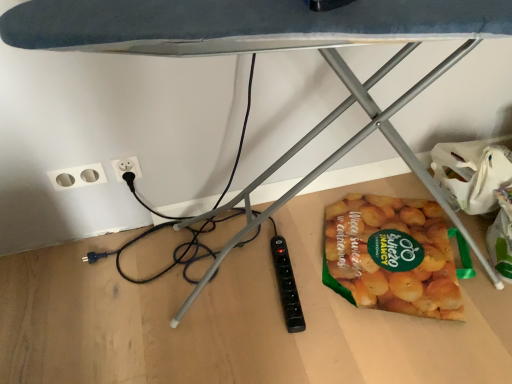
Question: From the image's perspective, is translucent plastic bag of sliced potatoes at lower right located beneath white plastic electric outlet at lower left?

Choices:
 (A) no
 (B) yes

Answer: (B)

Question: From a real-world perspective, is translucent plastic bag of sliced potatoes at lower right physically above white plastic electric outlet at lower left?

Choices:
 (A) yes
 (B) no

Answer: (B)

Question: Is translucent plastic bag of sliced potatoes at lower right further to camera compared to white plastic electric outlet at lower left?

Choices:
 (A) yes
 (B) no

Answer: (B)

Question: Is white plastic electric outlet at lower left inside translucent plastic bag of sliced potatoes at lower right?

Choices:
 (A) no
 (B) yes

Answer: (A)

Question: Does translucent plastic bag of sliced potatoes at lower right have a greater width compared to white plastic electric outlet at lower left?

Choices:
 (A) yes
 (B) no

Answer: (A)

Question: Does translucent plastic bag of sliced potatoes at lower right have a lesser width compared to white plastic electric outlet at lower left?

Choices:
 (A) no
 (B) yes

Answer: (A)

Question: From a real-world perspective, is white plastic socket at lower left positioned over translucent plastic bag of sliced potatoes at lower right based on gravity?

Choices:
 (A) yes
 (B) no

Answer: (A)

Question: Does white plastic socket at lower left appear on the left side of translucent plastic bag of sliced potatoes at lower right?

Choices:
 (A) no
 (B) yes

Answer: (B)

Question: From the image's perspective, does white plastic socket at lower left appear higher than translucent plastic bag of sliced potatoes at lower right?

Choices:
 (A) no
 (B) yes

Answer: (B)

Question: Would you say white plastic socket at lower left is outside translucent plastic bag of sliced potatoes at lower right?

Choices:
 (A) no
 (B) yes

Answer: (B)

Question: Would you say translucent plastic bag of sliced potatoes at lower right is part of white plastic socket at lower left's contents?

Choices:
 (A) yes
 (B) no

Answer: (B)

Question: From the image's perspective, is white plastic socket at lower left beneath translucent plastic bag of sliced potatoes at lower right?

Choices:
 (A) no
 (B) yes

Answer: (A)

Question: Can you confirm if translucent plastic bag of sliced potatoes at lower right is taller than white plastic socket at lower left?

Choices:
 (A) yes
 (B) no

Answer: (B)